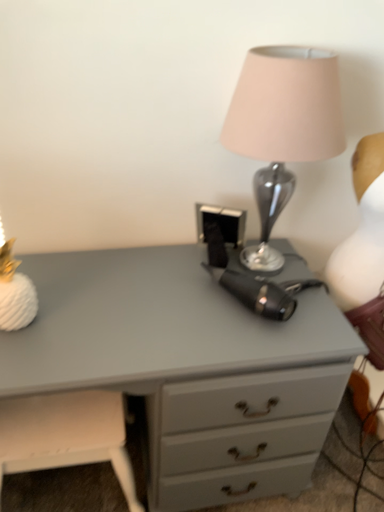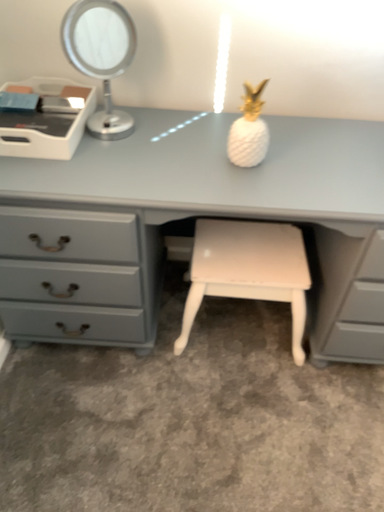
Question: How did the camera likely rotate when shooting the video?

Choices:
 (A) rotated downward
 (B) rotated upward

Answer: (A)